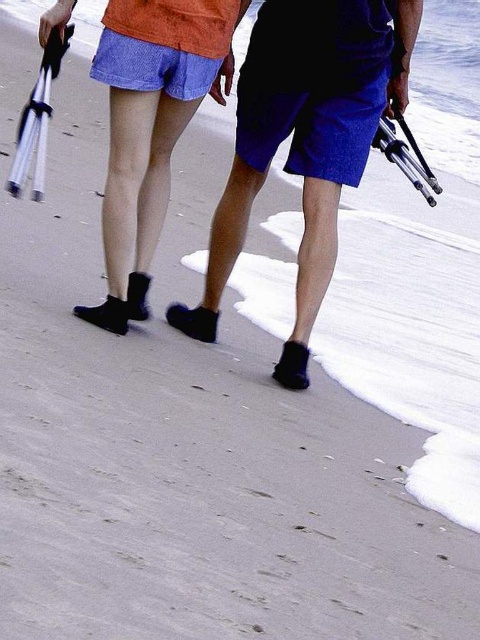
Does point (40, 156) lie behind point (61, 28)?

Yes, it is behind point (61, 28).

Is white matte umbrella at left to the right of matte black flippers at upper left from the viewer's perspective?

No, white matte umbrella at left is not to the right of matte black flippers at upper left.

Does point (31, 140) come farther from viewer compared to point (51, 12)?

Yes, point (31, 140) is farther from viewer.

Find the location of `white matte umbrella at left`. white matte umbrella at left is located at coordinates (37, 120).

Is matte black socks at center positioned behind matte black flippers at upper left?

No, matte black socks at center is closer to the viewer.

Who is positioned more to the right, matte black socks at center or matte black flippers at upper left?

matte black socks at center

Between point (188, 65) and point (59, 1), which one is positioned in front?

Point (59, 1) is more forward.

The width and height of the screenshot is (480, 640). I want to click on matte black socks at center, so click(x=149, y=128).

Is point (273, 10) closer to viewer compared to point (25, 148)?

No, it is behind (25, 148).

Between black rubber sandals at center and white matte umbrella at left, which one is positioned lower?

black rubber sandals at center

What do you see at coordinates (305, 140) in the screenshot? This screenshot has height=640, width=480. I see `black rubber sandals at center` at bounding box center [305, 140].

Find the location of a particular element. This screenshot has width=480, height=640. black rubber sandals at center is located at coordinates (305, 140).